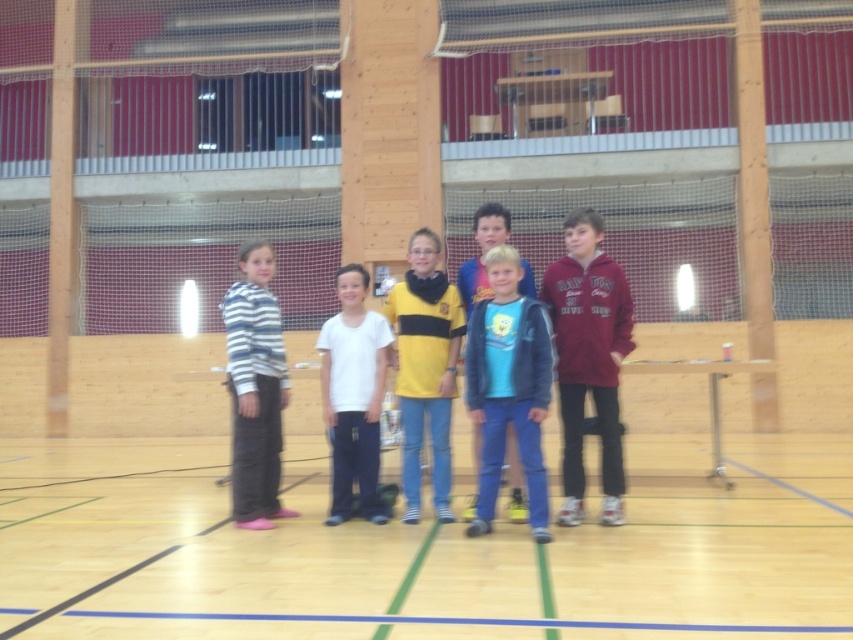
Question: From the image, what is the correct spatial relationship of striped hoodie at left in relation to white matte t-shirt at center?

Choices:
 (A) below
 (B) above

Answer: (B)

Question: Is maroon fleece jacket at center above yellow jersey at center?

Choices:
 (A) no
 (B) yes

Answer: (B)

Question: Which point is farther to the camera?

Choices:
 (A) (332, 410)
 (B) (271, 620)

Answer: (A)

Question: Can you confirm if blue matte shirt at center is smaller than yellow jersey at center?

Choices:
 (A) no
 (B) yes

Answer: (B)

Question: Which object appears farthest from the camera in this image?

Choices:
 (A) striped hoodie at left
 (B) maroon fleece jacket at center
 (C) wooden floor at center

Answer: (A)

Question: Based on their relative distances, which object is nearer to the maroon fleece jacket at center?

Choices:
 (A) white matte t-shirt at center
 (B) blue matte shirt at center

Answer: (B)